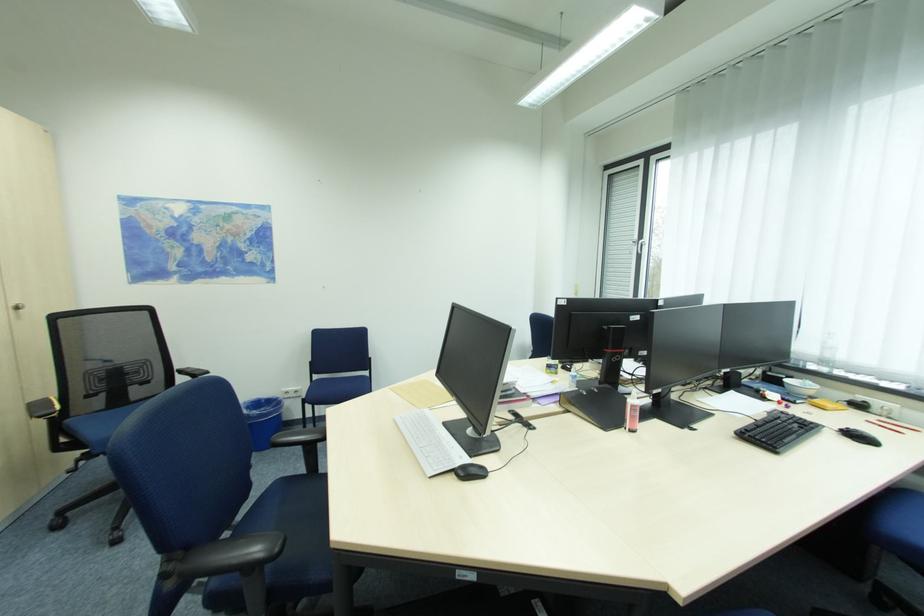
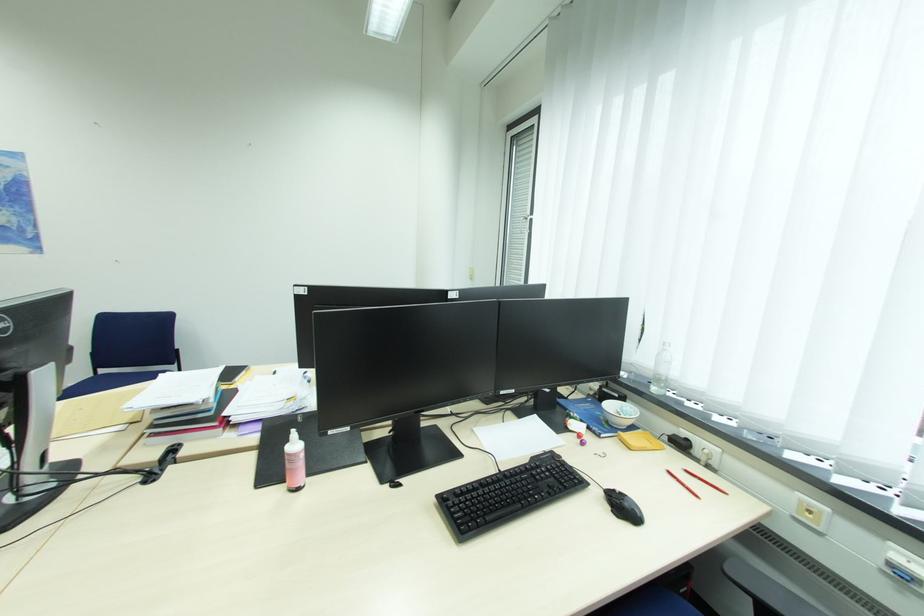
The images are taken continuously from a first-person perspective. In which direction are you moving?

The movement direction of the cameraman is right, forward.